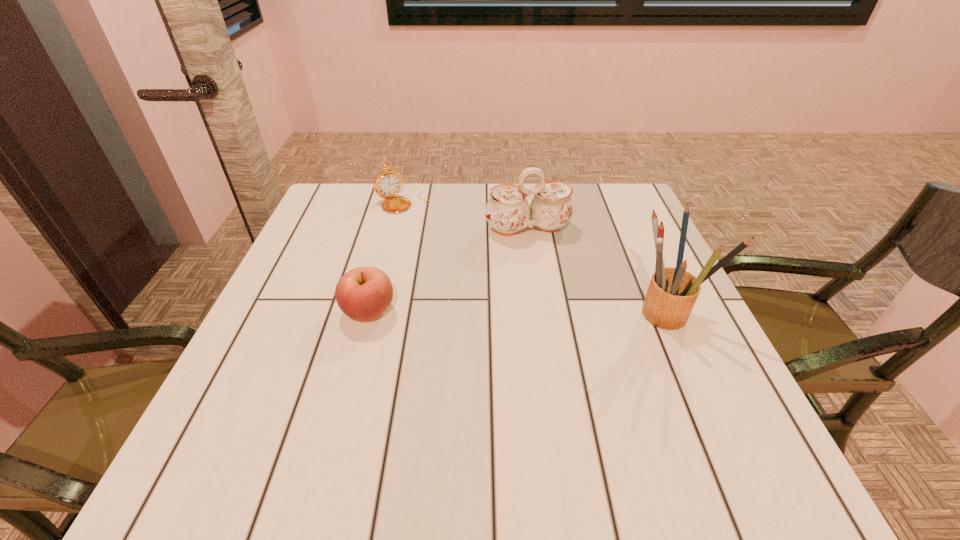
This screenshot has height=540, width=960. What are the coordinates of `free area in between the rightmost object and the pocket watch` in the screenshot? It's located at (536, 256).

At what (x,y) coordinates should I click in order to perform the action: click on free point between the second farthest object and the pencil box. Please return your answer as a coordinate pair (x, y). Image resolution: width=960 pixels, height=540 pixels. Looking at the image, I should click on (598, 270).

Where is `vacant region between the second object from right to left and the rightmost object`? Image resolution: width=960 pixels, height=540 pixels. vacant region between the second object from right to left and the rightmost object is located at coordinates (598, 270).

Find the location of a particular element. The height and width of the screenshot is (540, 960). free area in between the apple and the second farthest object is located at coordinates (448, 270).

Locate an element on the screen. free space between the apple and the second tallest object is located at coordinates (448, 270).

The height and width of the screenshot is (540, 960). I want to click on free spot between the farthest object and the tallest object, so click(x=536, y=256).

The image size is (960, 540). Identify the location of unoccupied position between the pocket watch and the chinaware. (466, 214).

Select which object is the closest to the rightmost object. Please provide its 2D coordinates. Your answer should be formatted as a tuple, i.e. [(x, y)], where the tuple contains the x and y coordinates of a point satisfying the conditions above.

[(507, 211)]

Where is `the third closest object to the tallest object`? This screenshot has height=540, width=960. the third closest object to the tallest object is located at coordinates (387, 184).

Identify the location of blank area in the image that satisfies the following two spatial constraints: 1. on the front side of the third shortest object; 2. on the left side of the pocket watch. This screenshot has width=960, height=540. (396, 228).